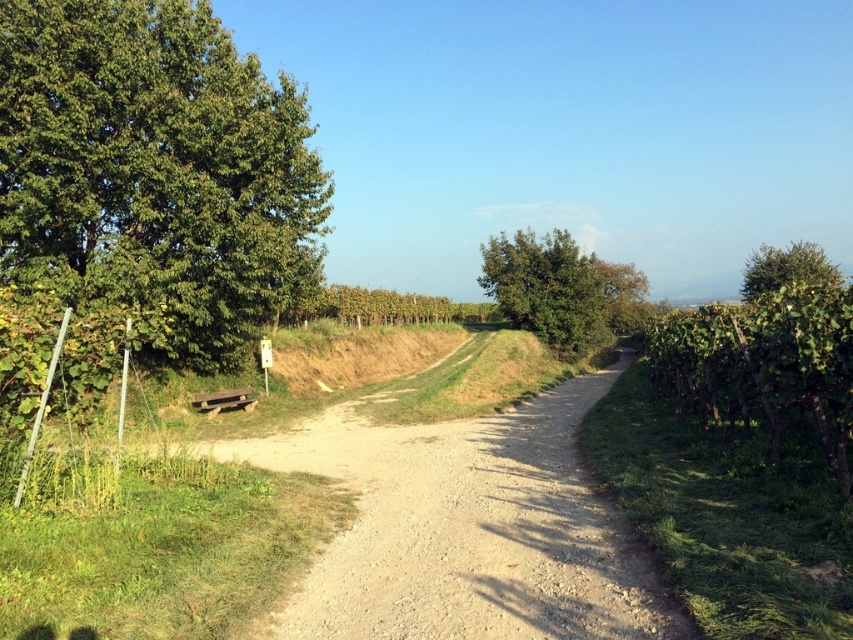
You are a photographer planning to take a photo of the green leafy tree at left and the dusty gravel path at center. Which object will appear larger in the photo?

The green leafy tree at left will appear larger in the photo because it is taller than the dusty gravel path at center.

You are a gardener who needs to water both the green leafy tree at left and the green leafy tree at right. Which tree requires more water based on their sizes?

The green leafy tree at right requires more water because it is larger than the green leafy tree at left.

You are a gardener planning to water the green leafy tree at left using a hose that can reach up to 15 feet. Based on the scene, will the hose be long enough to reach the tree from the dusty gravel path at center?

The distance between the green leafy tree at left and the dusty gravel path at center is 17.55 feet, which is longer than the hose can reach. Therefore, the hose will not be long enough to water the tree from the path.